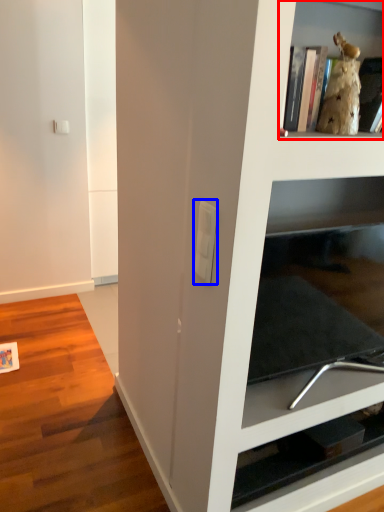
Question: Which object is further to the camera taking this photo, shelf (highlighted by a red box) or light switch (highlighted by a blue box)?

Choices:
 (A) shelf
 (B) light switch

Answer: (B)